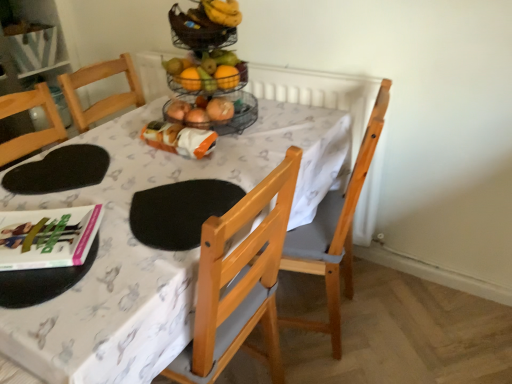
Question: Is orange matte grapefruit at upper center at the left side of hardcover book at lower left?

Choices:
 (A) no
 (B) yes

Answer: (A)

Question: Is orange matte grapefruit at upper center wider than hardcover book at lower left?

Choices:
 (A) no
 (B) yes

Answer: (B)

Question: Is orange matte grapefruit at upper center oriented towards hardcover book at lower left?

Choices:
 (A) no
 (B) yes

Answer: (B)

Question: Is orange matte grapefruit at upper center completely or partially outside of hardcover book at lower left?

Choices:
 (A) yes
 (B) no

Answer: (A)

Question: Is orange matte grapefruit at upper center shorter than hardcover book at lower left?

Choices:
 (A) no
 (B) yes

Answer: (A)

Question: Considering their positions, is orange matte grapefruit at upper center located in front of or behind light brown wooden chair at center?

Choices:
 (A) front
 (B) behind

Answer: (B)

Question: Considering the positions of orange matte grapefruit at upper center and light brown wooden chair at center in the image, is orange matte grapefruit at upper center wider or thinner than light brown wooden chair at center?

Choices:
 (A) thin
 (B) wide

Answer: (A)

Question: In terms of size, does orange matte grapefruit at upper center appear bigger or smaller than light brown wooden chair at center?

Choices:
 (A) big
 (B) small

Answer: (B)

Question: From a real-world perspective, relative to light brown wooden chair at center, is orange matte grapefruit at upper center vertically above or below?

Choices:
 (A) above
 (B) below

Answer: (A)

Question: From a real-world perspective, relative to orange plastic bag at center, is orange matte grapefruit at upper center vertically above or below?

Choices:
 (A) above
 (B) below

Answer: (A)

Question: Is orange matte grapefruit at upper center taller or shorter than orange plastic bag at center?

Choices:
 (A) tall
 (B) short

Answer: (A)

Question: Is point (189, 69) closer or farther from the camera than point (211, 148)?

Choices:
 (A) farther
 (B) closer

Answer: (A)

Question: Considering the relative positions of orange matte grapefruit at upper center and orange plastic bag at center in the image provided, is orange matte grapefruit at upper center to the left or to the right of orange plastic bag at center?

Choices:
 (A) right
 (B) left

Answer: (A)

Question: Is hardcover book at lower left bigger or smaller than white fabric table at center?

Choices:
 (A) big
 (B) small

Answer: (B)

Question: Is hardcover book at lower left in front of or behind white fabric table at center in the image?

Choices:
 (A) front
 (B) behind

Answer: (B)